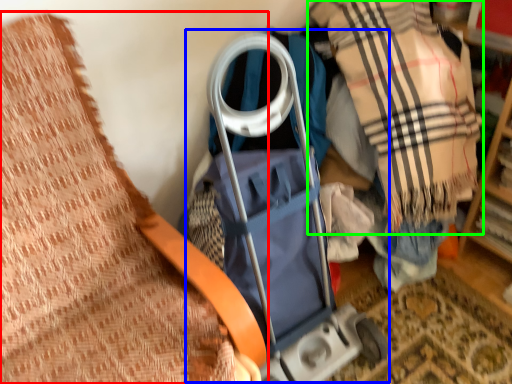
Question: Which object is positioned closest to furniture (highlighted by a red box)? Select from baby carriage (highlighted by a blue box) and plaid (highlighted by a green box).

Choices:
 (A) baby carriage
 (B) plaid

Answer: (A)